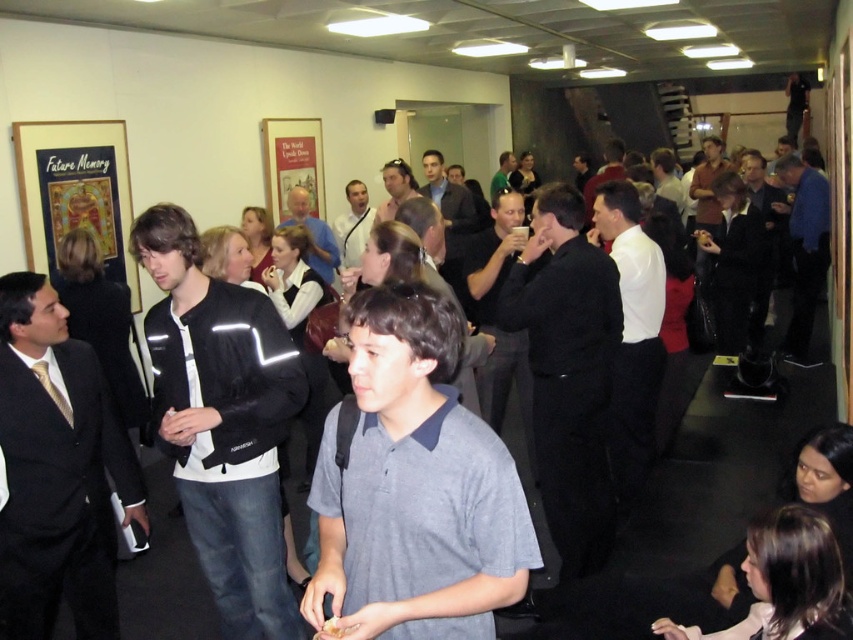
Looking at this image, you are an attendee at this event and want to speak to the person wearing the blue shirt at center. The person is currently standing with their back to you, and you can see the matte black jacket at center. Can you approach them directly without moving around any obstacles?

The matte black jacket at center is behind the blue shirt at center, so the person in the blue shirt at center is in front of the matte black jacket at center. Since the person in the blue shirt at center is facing away from you, you can approach them directly as there are no obstacles blocking your path between you and the blue shirt at center. However, you may need to move around the matte black jacket at center if it is part of the same person or another individual standing behind them.